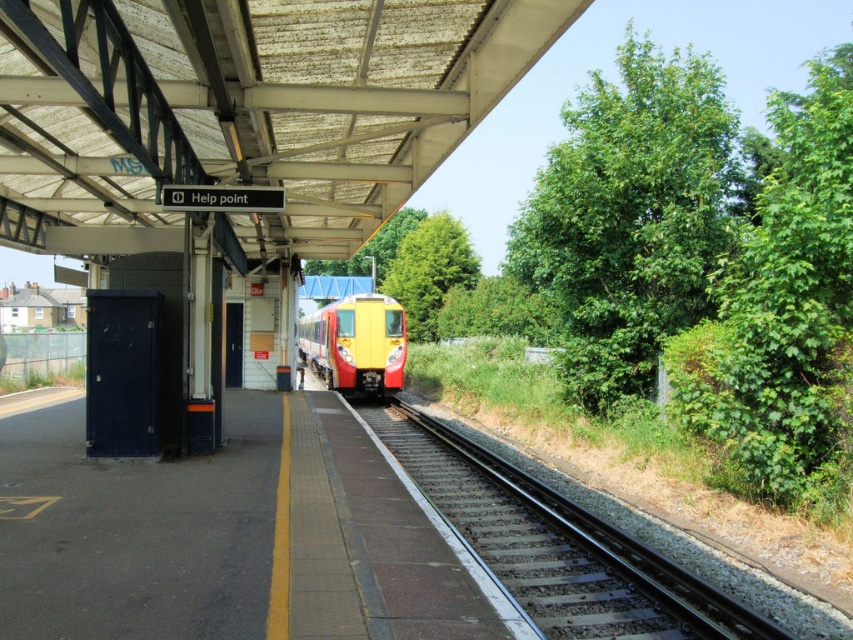
Question: Can you confirm if smooth metal train track at center is positioned to the left of yellow matte train at center?

Choices:
 (A) yes
 (B) no

Answer: (B)

Question: Considering the relative positions of smooth metal train track at center and yellow matte train at center in the image provided, where is smooth metal train track at center located with respect to yellow matte train at center?

Choices:
 (A) left
 (B) right

Answer: (B)

Question: Is smooth metal train track at center positioned at the back of yellow matte train at center?

Choices:
 (A) no
 (B) yes

Answer: (A)